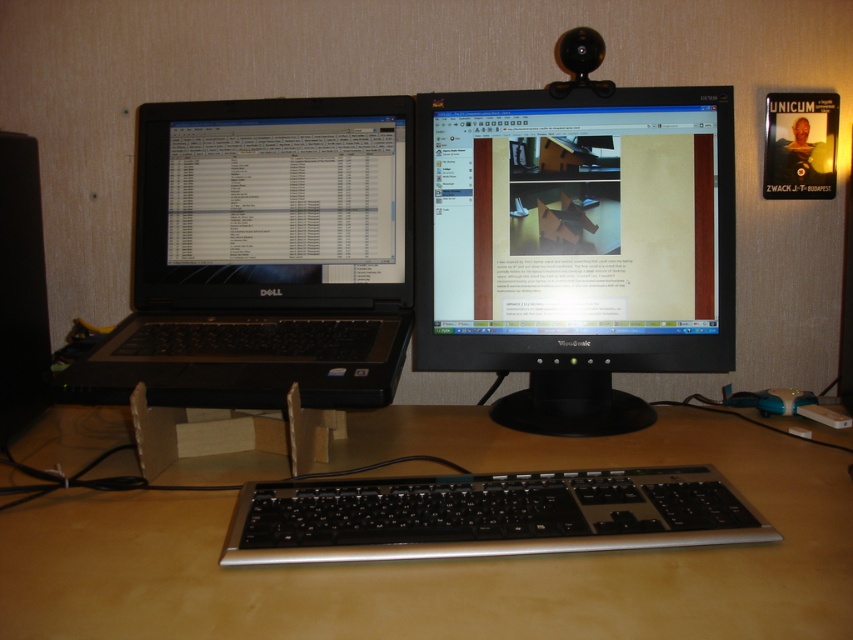
Question: Does brown wood computer desk at center appear under black plastic keyboard at center?

Choices:
 (A) yes
 (B) no

Answer: (A)

Question: Among these points, which one is farthest from the camera?

Choices:
 (A) (137, 620)
 (B) (190, 173)

Answer: (B)

Question: Which of the following is the closest to the observer?

Choices:
 (A) (717, 499)
 (B) (759, 582)

Answer: (B)

Question: Is black matte laptop at left further to the viewer compared to black plastic keyboard at center?

Choices:
 (A) no
 (B) yes

Answer: (B)

Question: Which point is closer to the camera taking this photo?

Choices:
 (A) (677, 298)
 (B) (213, 285)
 (C) (483, 576)
 (D) (234, 532)

Answer: (C)

Question: Is brown wood computer desk at center closer to camera compared to black plastic keyboard at center?

Choices:
 (A) no
 (B) yes

Answer: (B)